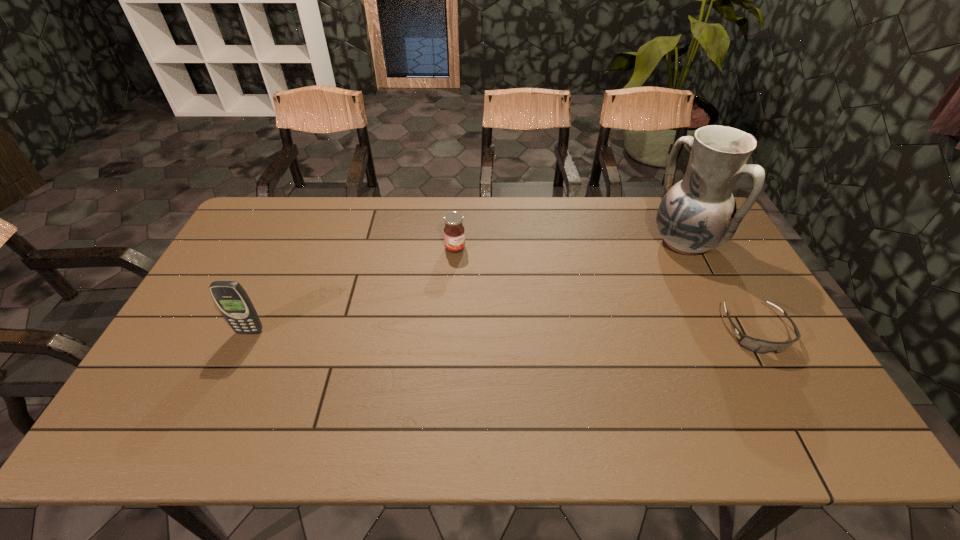
The width and height of the screenshot is (960, 540). In order to click on free space between the cellular telephone and the pitcher in this screenshot , I will do `click(468, 287)`.

You are a GUI agent. You are given a task and a screenshot of the screen. Output one action in this format:
    pyautogui.click(x=<x>, y=<y>)
    Task: Click on the free space between the leftmost object and the second object from left to right
    This screenshot has width=960, height=540.
    Given the screenshot: What is the action you would take?
    pyautogui.click(x=352, y=290)

The image size is (960, 540). What are the coordinates of `free area in between the cellular telephone and the goggles` in the screenshot? It's located at (503, 331).

Identify the location of free spot between the third shortest object and the third object from right to left. (352, 290).

Where is `object that is the second closest to the jam`? The height and width of the screenshot is (540, 960). object that is the second closest to the jam is located at coordinates (698, 214).

Select which object appears as the third closest to the cellular telephone. Please provide its 2D coordinates. Your answer should be formatted as a tuple, i.e. [(x, y)], where the tuple contains the x and y coordinates of a point satisfying the conditions above.

[(760, 346)]

At what (x,y) coordinates should I click in order to perform the action: click on vacant point that satisfies the following two spatial constraints: 1. on the back side of the tallest object; 2. on the right side of the third tallest object. Please return your answer as a coordinate pair (x, y). Looking at the image, I should click on (455, 242).